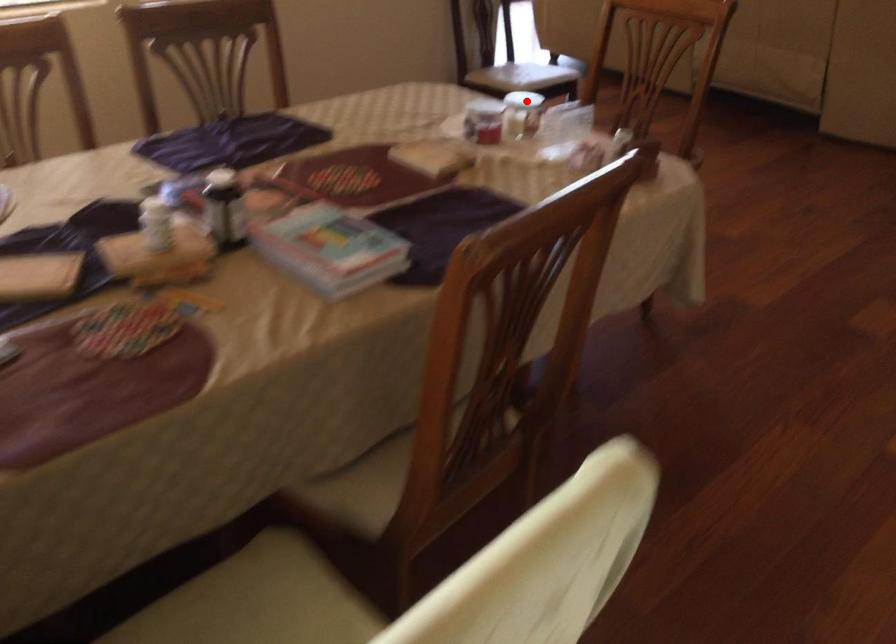
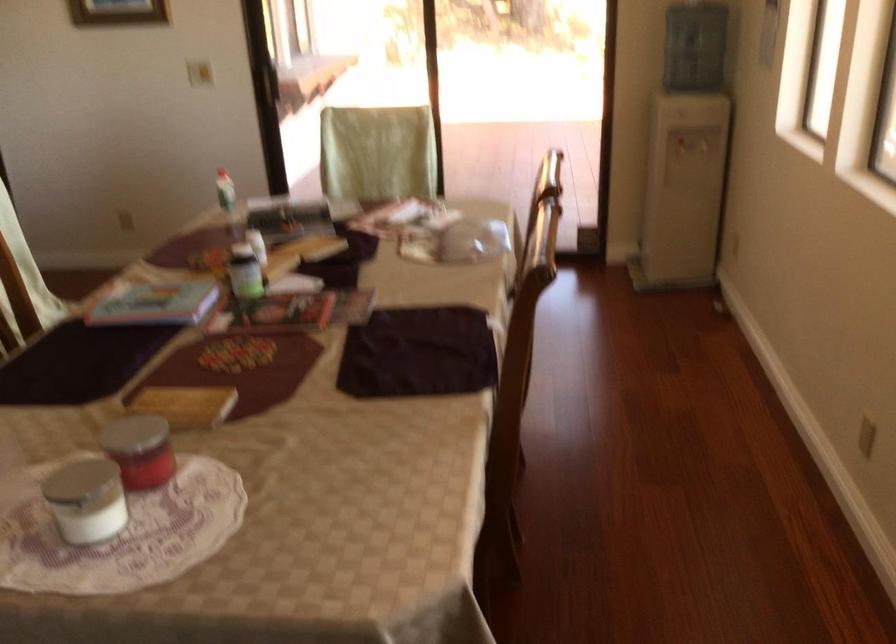
Question: I am providing you with two images of the same scene from different viewpoints. Given a red point in image1, look at the same physical point in image2. Is it:

Choices:
 (A) Closer to the viewpoint
 (B) Farther from the viewpoint

Answer: (A)